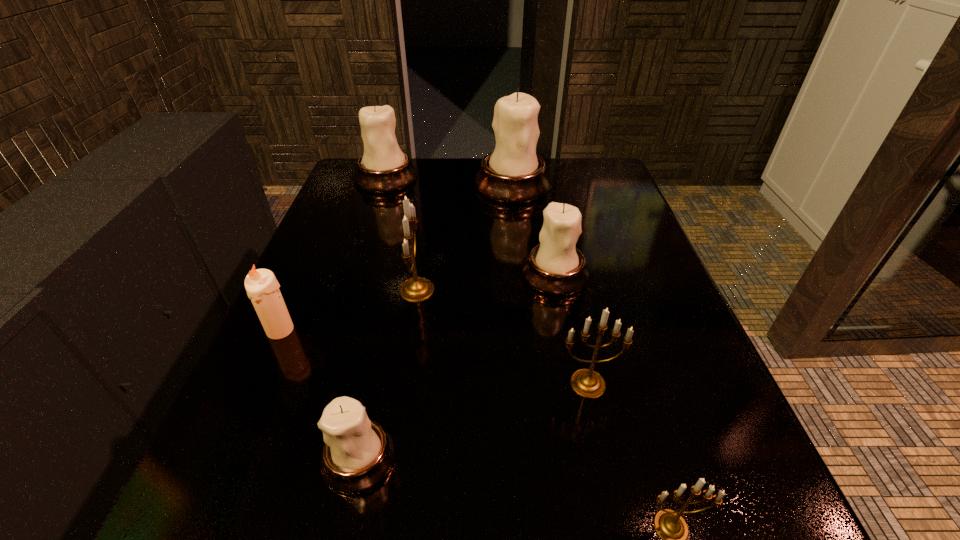
Identify the location of object that is positioned at the near left corner. The image size is (960, 540). (358, 453).

Where is `free space at the far edge of the desktop`? The width and height of the screenshot is (960, 540). free space at the far edge of the desktop is located at coordinates (561, 192).

This screenshot has height=540, width=960. Identify the location of blank space at the left edge of the desktop. (388, 209).

Identify the location of vacant space at the right edge. (598, 241).

Locate an element on the screen. free spot at the far left corner of the desktop is located at coordinates 340,200.

In the image, there is a desktop. In order to click on vacant space at the far right corner in this screenshot , I will do click(605, 158).

Find the location of a particular element. The image size is (960, 540). free space that is in between the second biggest white candle holder and the tallest object is located at coordinates pyautogui.click(x=449, y=181).

Locate an element on the screen. free spot between the biggest gold candelabrum and the second smallest white candle holder is located at coordinates (486, 282).

This screenshot has height=540, width=960. I want to click on vacant area that lies between the candle and the sixth farthest candelabrum, so click(320, 394).

This screenshot has width=960, height=540. Find the location of `vacant point located between the second nearest white candle holder and the tallest candelabrum`. vacant point located between the second nearest white candle holder and the tallest candelabrum is located at coordinates (534, 230).